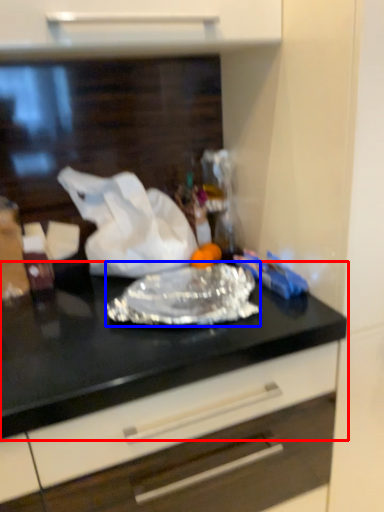
Question: Which of the following is the closest to the observer, countertop (highlighted by a red box) or wrap (highlighted by a blue box)?

Choices:
 (A) countertop
 (B) wrap

Answer: (A)